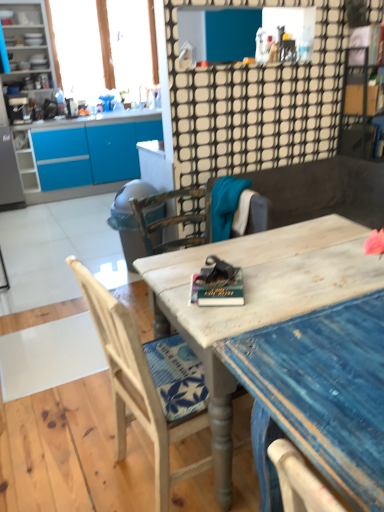
Question: Is wooden chair at center, marked as the 1th chair in a front-to-back arrangement, inside or outside of translucent fabric at upper left?

Choices:
 (A) inside
 (B) outside

Answer: (B)

Question: Considering the positions of wooden chair at center, the 2th chair positioned from the back, and translucent fabric at upper left in the image, is wooden chair at center, the 2th chair positioned from the back, bigger or smaller than translucent fabric at upper left?

Choices:
 (A) small
 (B) big

Answer: (B)

Question: Estimate the real-world distances between objects in this image. Which object is closer to the translucent fabric at upper left?

Choices:
 (A) wooden chair at center, the 1th chair from the back
 (B) distressed wood desk at center
 (C) wooden chair at center
 (D) matte gray trash can at center-left
 (E) wooden chair at center, the 2th chair positioned from the back

Answer: (C)

Question: Which of these objects is positioned closest to the matte gray trash can at center-left?

Choices:
 (A) wooden chair at center
 (B) wooden chair at center, the 2th chair positioned from the back
 (C) distressed wood desk at center
 (D) translucent fabric at upper left
 (E) matte white cabinet at upper left

Answer: (C)